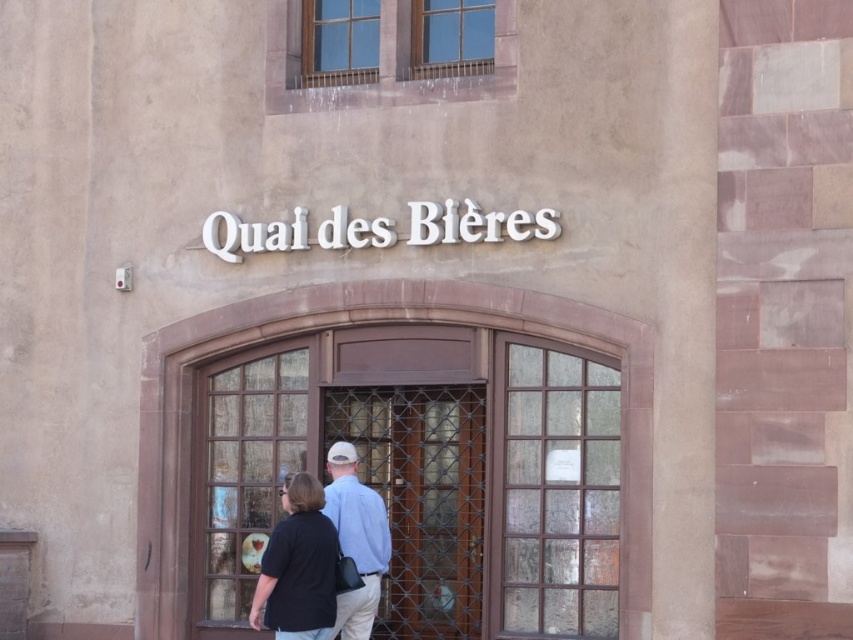
Question: Which of these objects is positioned closest to the dark blue shirt at center?

Choices:
 (A) brown wooden door at center
 (B) wooden door at center
 (C) light blue shirt at center

Answer: (C)

Question: Among these points, which one is farthest from the camera?

Choices:
 (A) (170, 387)
 (B) (473, 433)
 (C) (355, 518)

Answer: (A)

Question: Can you confirm if dark blue shirt at center is positioned below light blue shirt at center?

Choices:
 (A) no
 (B) yes

Answer: (B)

Question: Estimate the real-world distances between objects in this image. Which object is closer to the brown wooden door at center?

Choices:
 (A) light blue shirt at center
 (B) wooden door at center

Answer: (B)

Question: Does wooden door at center have a larger size compared to light blue shirt at center?

Choices:
 (A) yes
 (B) no

Answer: (A)

Question: Considering the relative positions of wooden door at center and light blue shirt at center in the image provided, where is wooden door at center located with respect to light blue shirt at center?

Choices:
 (A) below
 (B) above

Answer: (B)